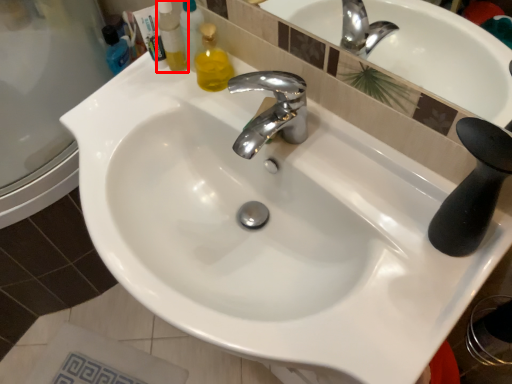
Question: From the image's perspective, where is cleaning product (annotated by the red box) located relative to tap?

Choices:
 (A) above
 (B) below

Answer: (A)